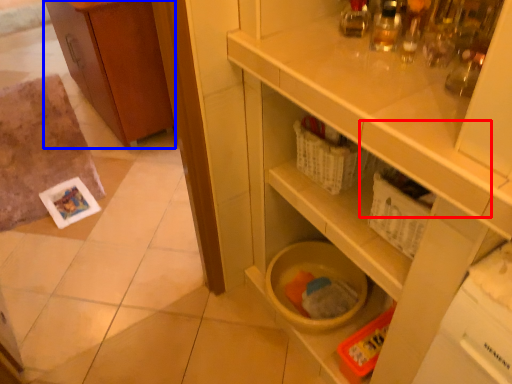
Question: Which object appears farthest to the camera in this image, drawer (highlighted by a red box) or cabinetry (highlighted by a blue box)?

Choices:
 (A) drawer
 (B) cabinetry

Answer: (B)